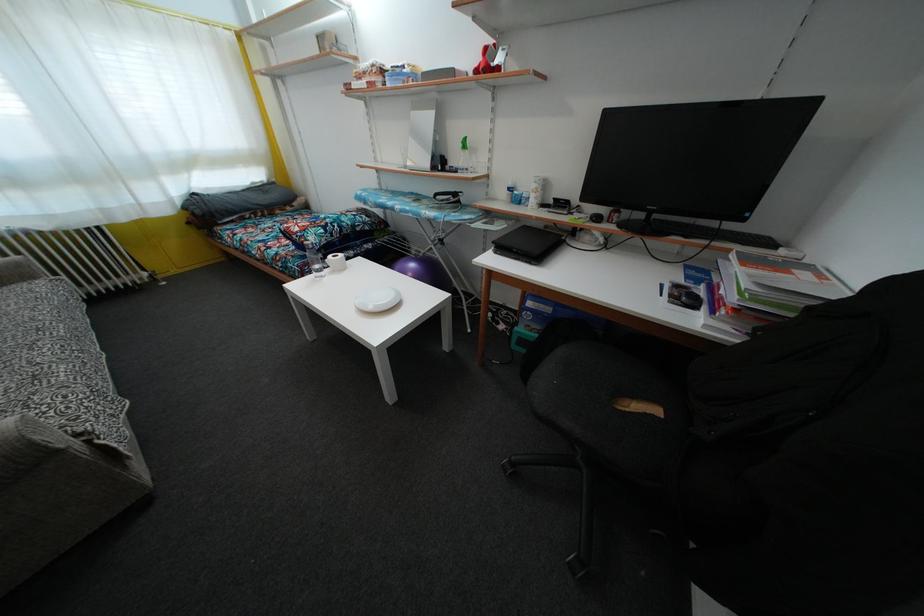
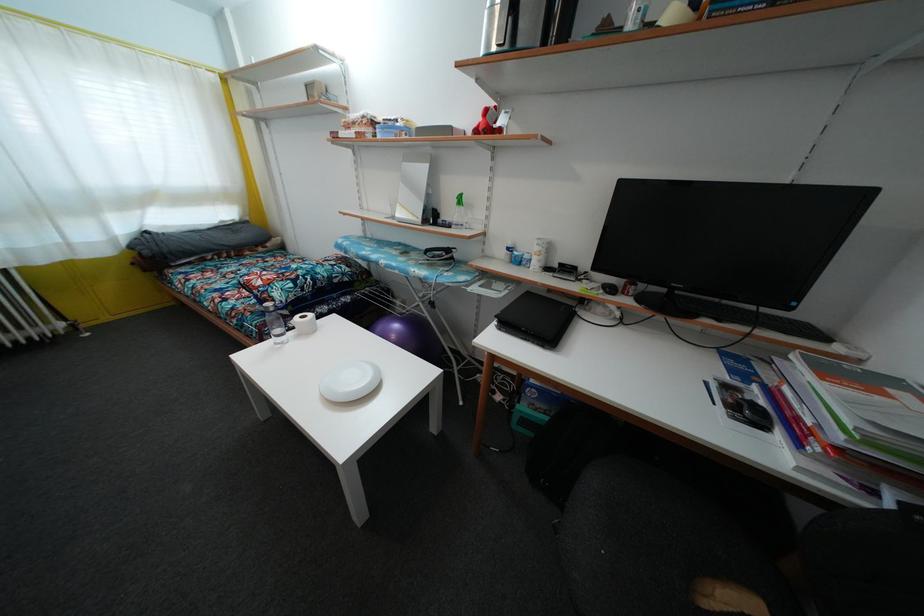
Where in the second image is the point corresponding to point (490, 58) from the first image?

(490, 119)